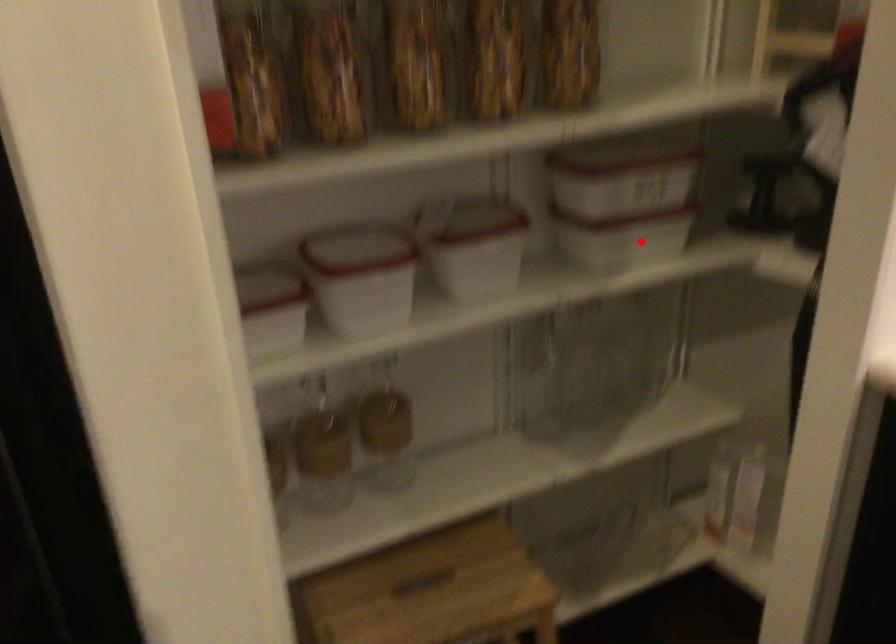
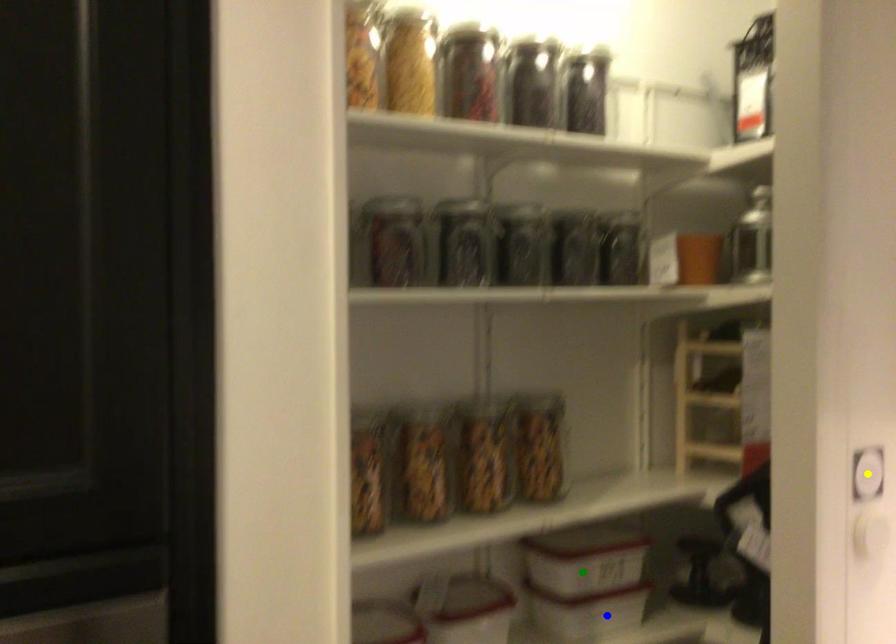
Question: I am providing you with two images of the same scene from different viewpoints. A red point is marked on the first image. You are given multiple points on the second image. In image 2, which mark is for the same physical point as the one in image 1?

Choices:
 (A) yellow point
 (B) blue point
 (C) green point

Answer: (B)